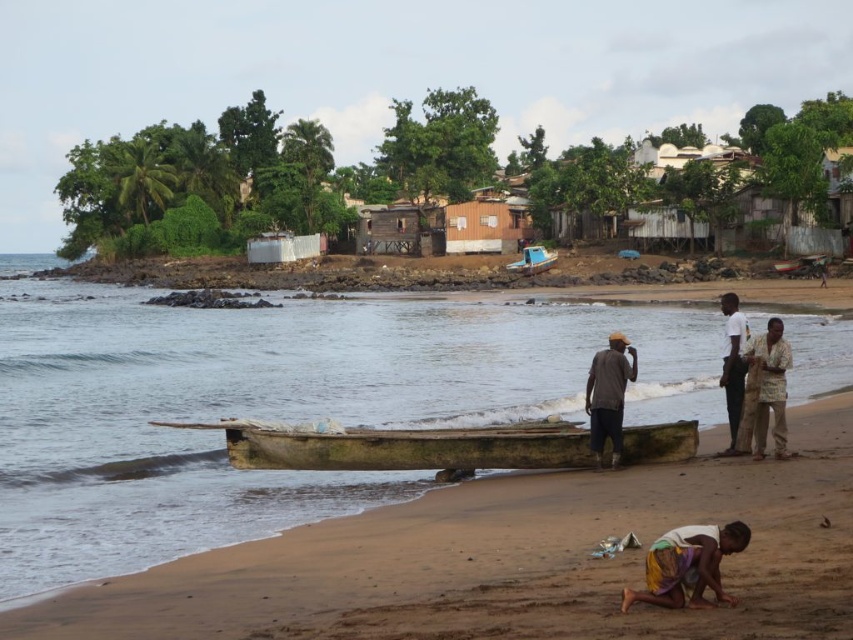
Question: Is wooden boat at center bigger than brown matte shirt at center?

Choices:
 (A) no
 (B) yes

Answer: (B)

Question: Is the position of yellow fabric skirt at lower right more distant than that of blue plastic boat at center?

Choices:
 (A) no
 (B) yes

Answer: (A)

Question: Estimate the real-world distances between objects in this image. Which object is farther from the white matte shirt at right?

Choices:
 (A) yellow fabric skirt at lower right
 (B) blue plastic boat at center

Answer: (B)

Question: Is white matte shirt at right above blue plastic boat at center?

Choices:
 (A) no
 (B) yes

Answer: (A)

Question: Among these objects, which one is farthest from the camera?

Choices:
 (A) brown matte shirt at center
 (B) blue plastic boat at center
 (C) white matte shirt at right
 (D) yellow fabric skirt at lower right

Answer: (B)

Question: Among these points, which one is farthest from the camera?

Choices:
 (A) (x=647, y=600)
 (B) (x=560, y=595)
 (C) (x=202, y=428)

Answer: (C)